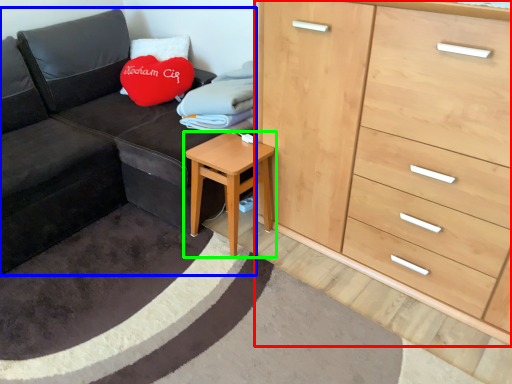
Question: Estimate the real-world distances between objects in this image. Which object is closer to chest of drawers (highlighted by a red box), studio couch (highlighted by a blue box) or table (highlighted by a green box)?

Choices:
 (A) studio couch
 (B) table

Answer: (B)